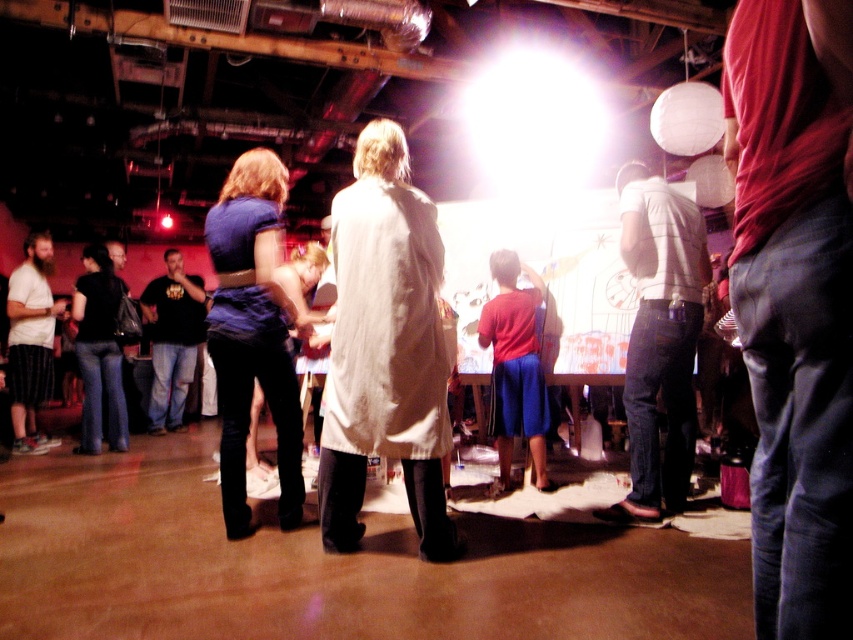
Question: Considering the real-world distances, which object is closest to the matte blue shirt at left?

Choices:
 (A) black cotton shirt at left
 (B) denim jeans at lower left
 (C) white textured shirt at center
 (D) red cotton shirt at right

Answer: (B)

Question: Among these objects, which one is farthest from the camera?

Choices:
 (A) white textured shirt at center
 (B) denim jeans at lower left
 (C) red cotton shirt at right

Answer: (B)

Question: Does red cotton shirt at right appear over matte blue shirt at left?

Choices:
 (A) yes
 (B) no

Answer: (A)

Question: Is white cotton coat at center to the left of denim pants at lower left from the viewer's perspective?

Choices:
 (A) no
 (B) yes

Answer: (A)

Question: Can you confirm if denim jeans at lower left is smaller than black cotton shirt at left?

Choices:
 (A) yes
 (B) no

Answer: (A)

Question: Among these objects, which one is nearest to the camera?

Choices:
 (A) white cotton coat at center
 (B) matte blue shirt at left
 (C) denim pants at lower left
 (D) black cotton shirt at left

Answer: (A)